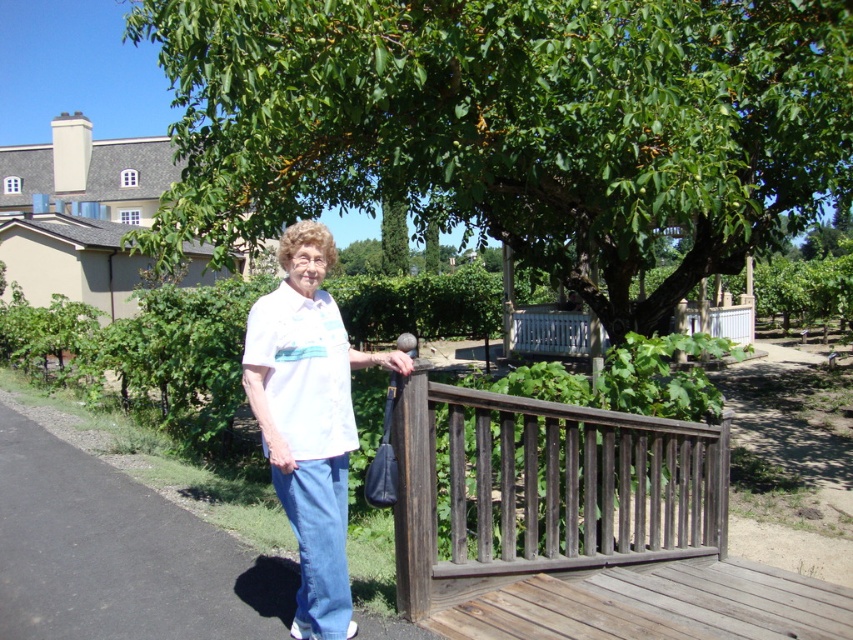
You are planning to place a 1.2 meter tall flower pot on the smooth asphalt path at center. Based on the scene, will the flower pot be taller than the weathered wood deck at lower right?

The smooth asphalt path at center is not as tall as weathered wood deck at lower right. Since the flower pot is 1.2 meters tall, it will be taller than the smooth asphalt path at center but not necessarily taller than the weathered wood deck at lower right. However, the description does not provide the height of the deck, so we cannot confirm if the flower pot will be taller than the deck.

You are standing at the wooden railing where the elderly woman is. You want to walk to the smooth asphalt path at center. In which direction should you move?

The smooth asphalt path at center is located at point (119, 554), so you should move forward and to the right to reach it.